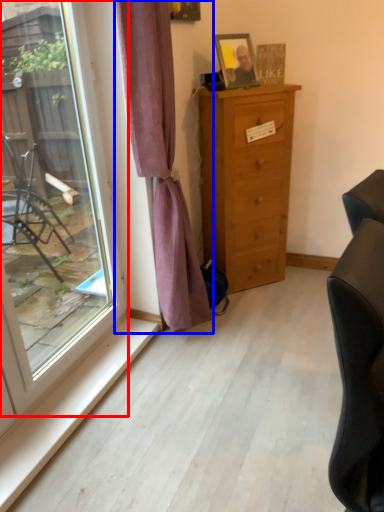
Question: Which point is closer to the camera, window (highlighted by a red box) or curtain (highlighted by a blue box)?

Choices:
 (A) window
 (B) curtain

Answer: (A)